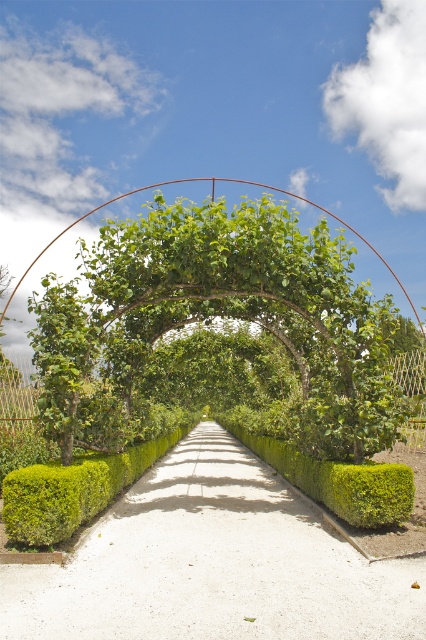
Question: Does green leafy tree at center appear under green leafy bush at lower left?

Choices:
 (A) no
 (B) yes

Answer: (A)

Question: Which point is closer to the camera?

Choices:
 (A) green leafy tree at center
 (B) green leafy tree at left
 (C) green hedge at center
 (D) green leafy hedge at center

Answer: (C)

Question: Is green leafy tree at center behind green leafy bush at lower left?

Choices:
 (A) yes
 (B) no

Answer: (A)

Question: Which is nearer to the green leafy tree at center?

Choices:
 (A) green leafy tree at left
 (B) green hedge at center

Answer: (A)

Question: Can you confirm if green hedge at center is wider than green leafy tree at left?

Choices:
 (A) yes
 (B) no

Answer: (A)

Question: Which of the following is the farthest from the observer?

Choices:
 (A) green hedge at center
 (B) green leafy hedge at center
 (C) green leafy tree at center
 (D) green leafy tree at left

Answer: (C)